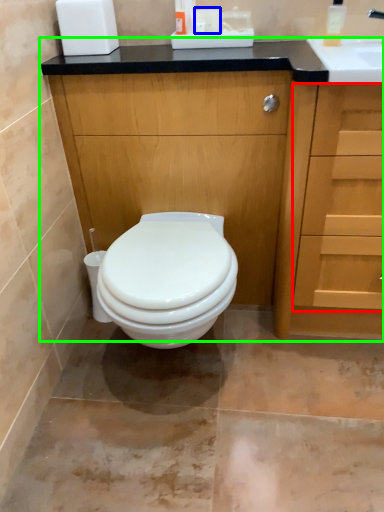
Question: Based on their relative distances, which object is nearer to drawer (highlighted by a red box)? Choose from toilet paper (highlighted by a blue box) and bathroom cabinet (highlighted by a green box).

Choices:
 (A) toilet paper
 (B) bathroom cabinet

Answer: (B)